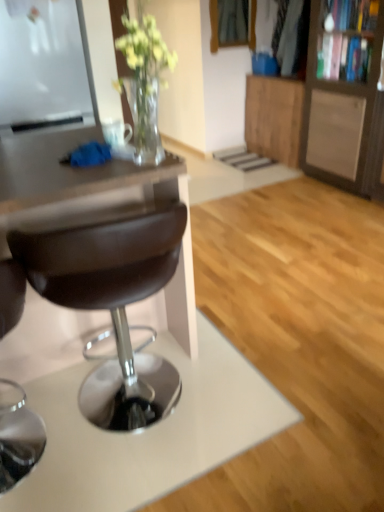
Where is `free space in front of brown leather stool at center`? The image size is (384, 512). free space in front of brown leather stool at center is located at coordinates (156, 479).